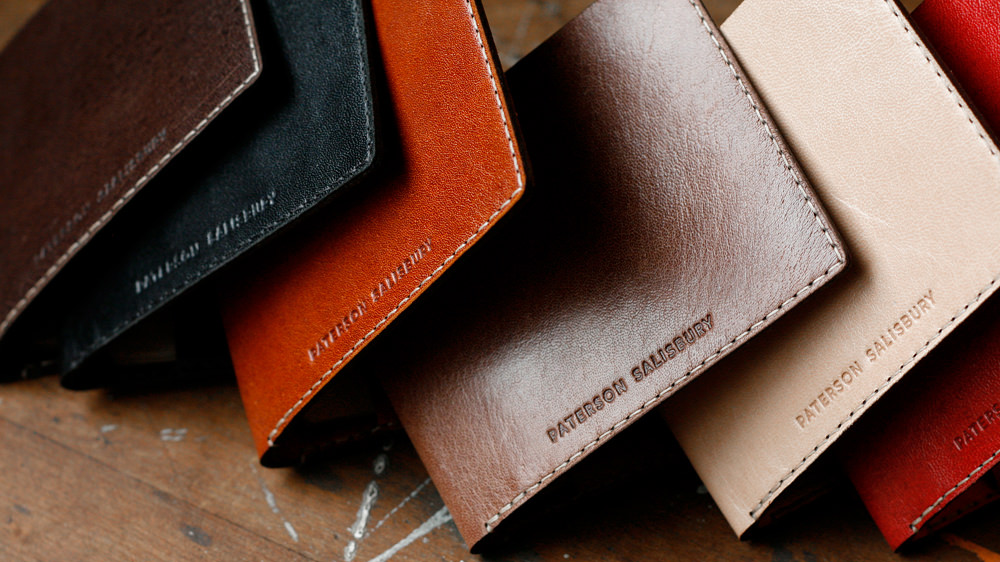
Identify the location of card holder. The height and width of the screenshot is (562, 1000). (771, 448).